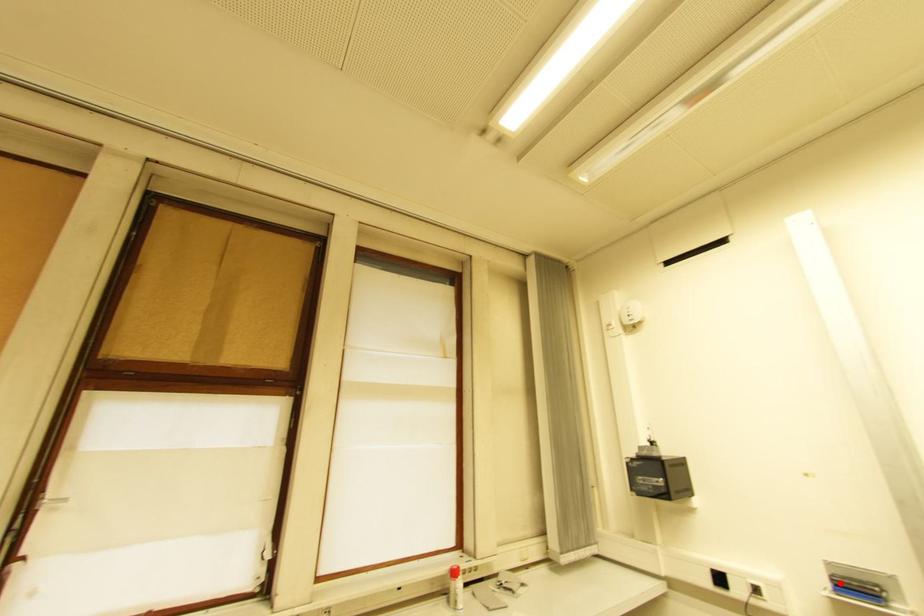
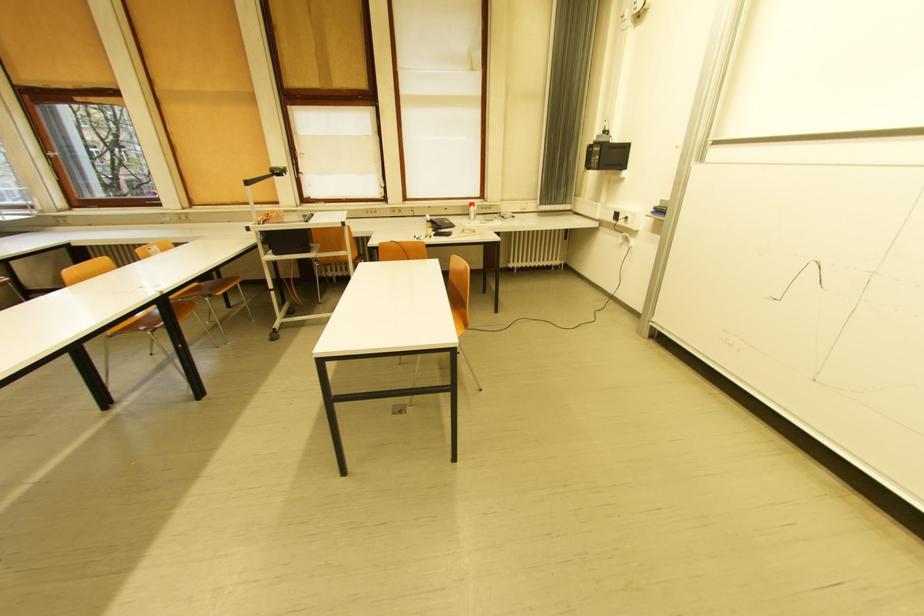
Question: I am providing you with two images of the same scene from different viewpoints. A red point is marked on the first image. Can you still see the location of the red point in image 2?

Choices:
 (A) Yes
 (B) No

Answer: (A)